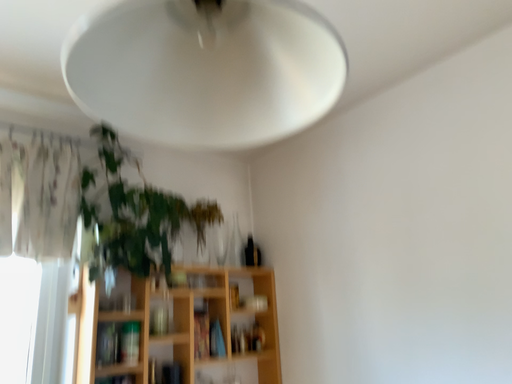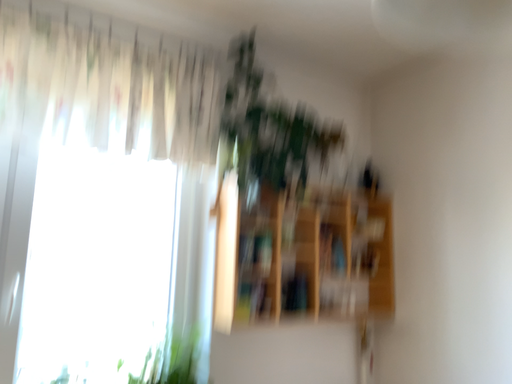
Question: How did the camera likely rotate when shooting the video?

Choices:
 (A) rotated right
 (B) rotated left

Answer: (B)